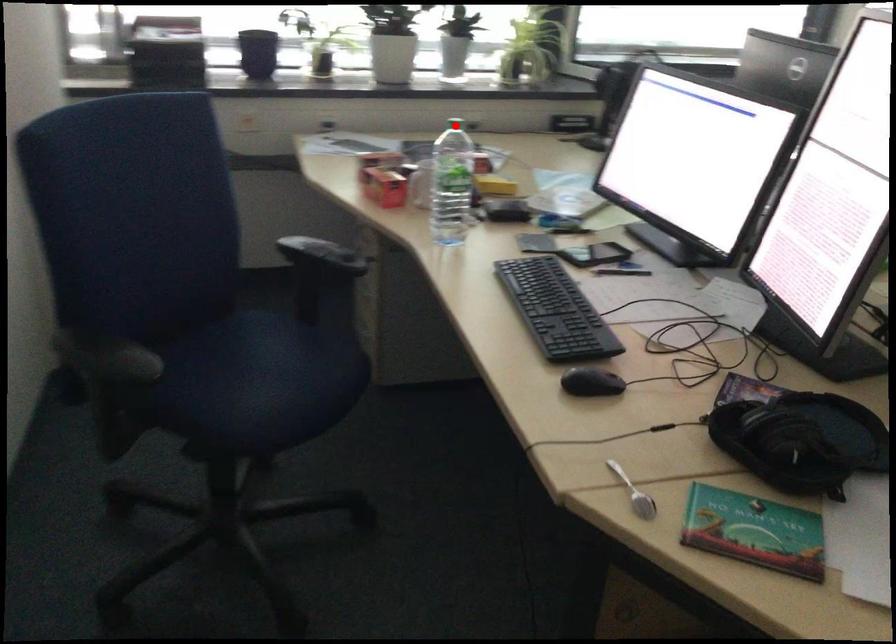
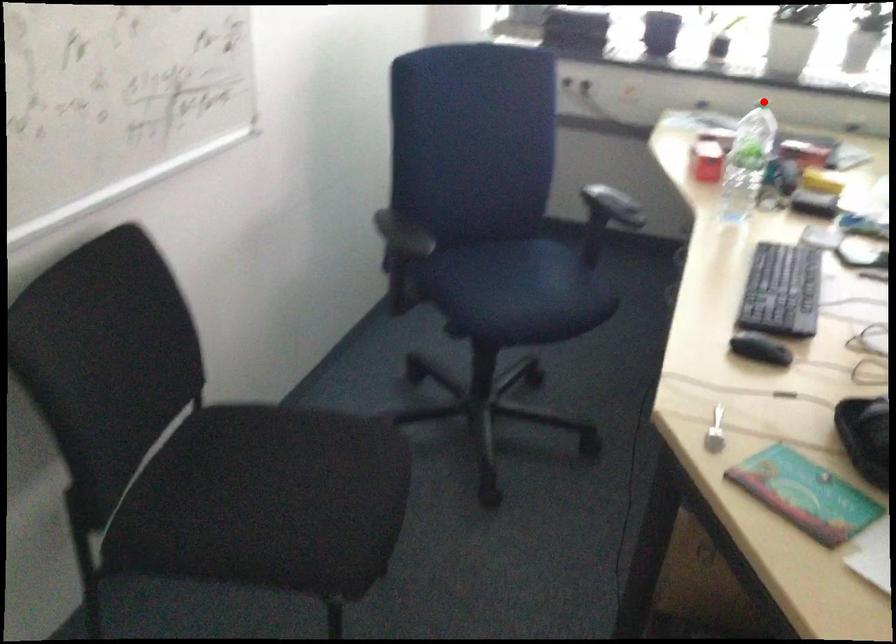
I am providing you with two images of the same scene from different viewpoints. A red point is marked on the first image and another point is marked on the second image. Is the marked point in image1 the same physical position as the marked point in image2?

Yes